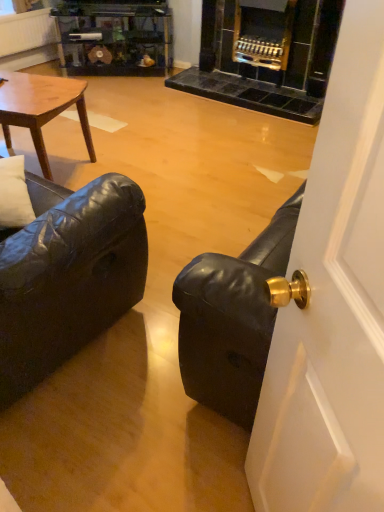
Question: In the image, is black leather couch at left positioned in front of or behind black leather couch at right?

Choices:
 (A) front
 (B) behind

Answer: (B)

Question: Would you say black leather couch at left is inside or outside black leather couch at right?

Choices:
 (A) outside
 (B) inside

Answer: (A)

Question: Based on their relative distances, which object is farther from the black leather couch at right?

Choices:
 (A) black leather couch at left
 (B) wooden glossy coffee table at upper left

Answer: (B)

Question: Which object is positioned farthest from the black leather couch at left?

Choices:
 (A) black leather couch at right
 (B) wooden glossy coffee table at upper left

Answer: (B)